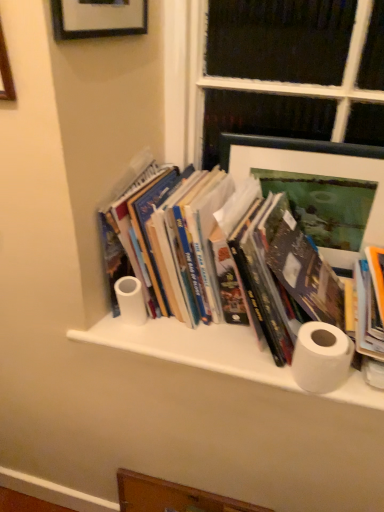
Where is `free area in between white matte toilet paper at center, the 2th toilet paper viewed from the front, and white matte toilet paper at right, placed as the second toilet paper when sorted from back to front`? free area in between white matte toilet paper at center, the 2th toilet paper viewed from the front, and white matte toilet paper at right, placed as the second toilet paper when sorted from back to front is located at coordinates (215, 347).